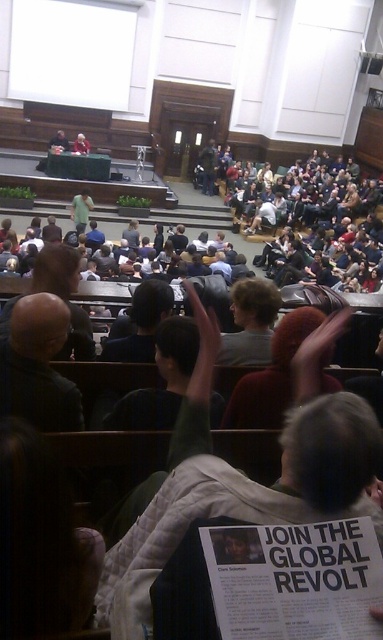
You are sitting in the audience and notice two people in front of you. One has a bald head at left and the other is wearing a light gray sweater at center. Which one is positioned more to the right side from your viewpoint?

The bald head at left is positioned to the right of the light gray sweater at center, so the bald head at left is more to the right side from your viewpoint.

You are a photographer in the back of the lecture hall and want to take a photo of the bald head at left and the light gray sweater at center. Which one is blocking your view of the other?

The bald head at left is positioned under the light gray sweater at center, so the light gray sweater at center is blocking the view of the bald head at left.